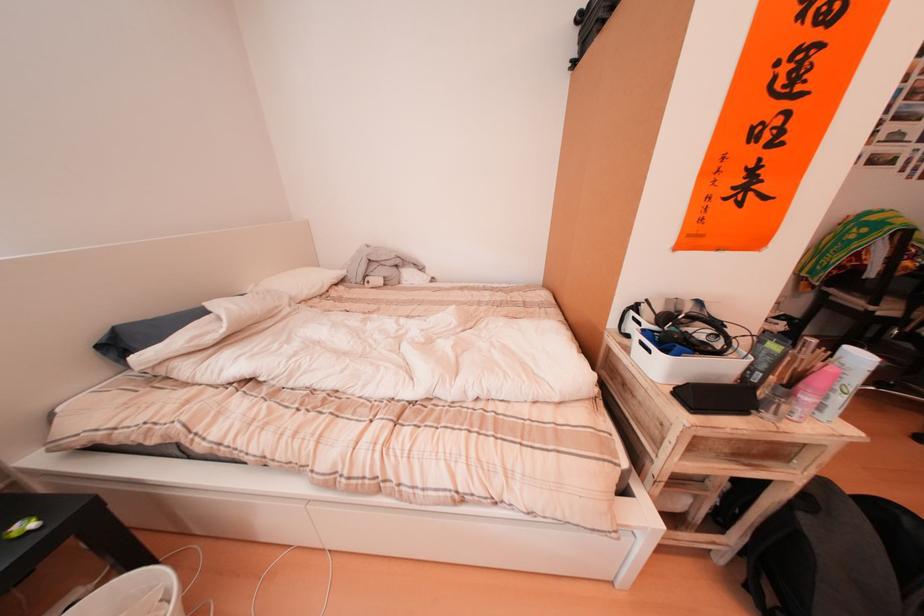
The location [143,333] corresponds to which object?

It corresponds to the black rectangular case in the image.